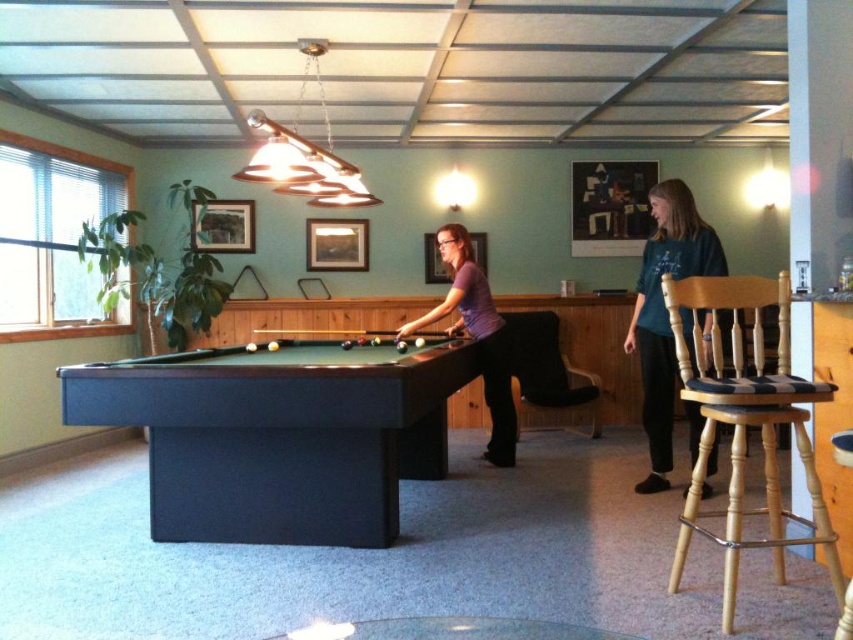
Based on the photo, you are organizing a charity clothing drive and need to pack shirts into boxes. You have two shirts in front of you on the pool table in the game room. The teal fabric shirt at right and the purple matte shirt at center. Which shirt should you choose if you want to pack the larger one first?

The purple matte shirt at center is larger than the teal fabric shirt at right, so you should choose the purple matte shirt at center first.

You are standing at the entrance of the game room and want to reach the dark green felt pool table at center. The room has a width of 3 meters. Can you walk straight to the pool table without any obstacles?

The distance between you and the dark green felt pool table at center is 2.93 meters, which is less than the room width of 3 meters. Therefore, you can walk straight to the dark green felt pool table at center without any obstacles.

You are organizing a closet and need to place the teal fabric shirt at right and the purple matte shirt at center. The space between them must be exactly 3 feet. Can you fit both shirts in this space?

The teal fabric shirt at right and purple matte shirt at center are 3.47 feet apart, so they can be placed with the required 3 feet between them since 3.47 feet is more than 3 feet.